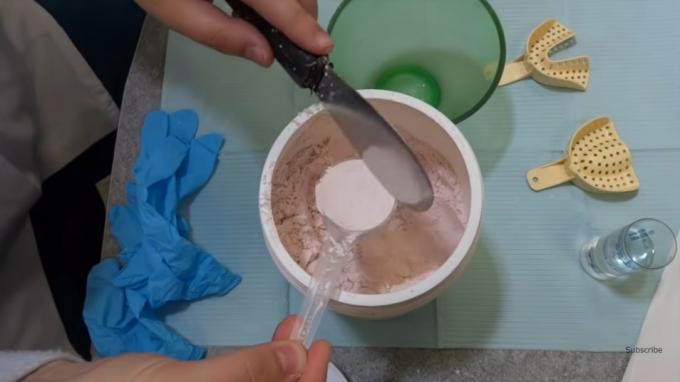
The width and height of the screenshot is (680, 382). I want to click on bowl, so click(435, 284).